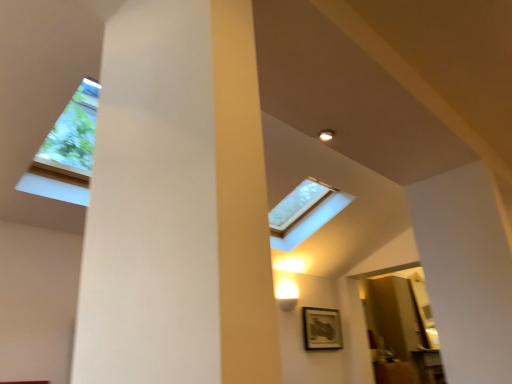
In order to face matte black picture frame at lower right, should I rotate leftwards or rightwards?

You should rotate right by 8.932 degrees.

What is the approximate width of matte black picture frame at lower right?

2.98 inches.

Find the location of `matte black picture frame at lower right`. matte black picture frame at lower right is located at coordinates (x=322, y=329).

Consider the image. Measure the distance between point (x=330, y=334) and camera.

The depth of point (x=330, y=334) is 6.51 meters.

The image size is (512, 384). Describe the element at coordinates (322, 329) in the screenshot. I see `matte black picture frame at lower right` at that location.

The height and width of the screenshot is (384, 512). Find the location of `matte black picture frame at lower right`. matte black picture frame at lower right is located at coordinates (322, 329).